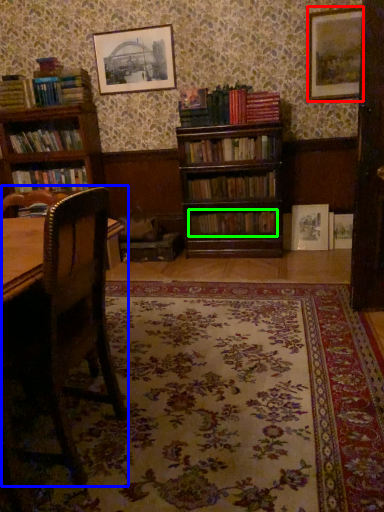
Question: Which is nearer to the picture frame (highlighted by a red box)? rocking chair (highlighted by a blue box) or book (highlighted by a green box).

Choices:
 (A) rocking chair
 (B) book

Answer: (B)